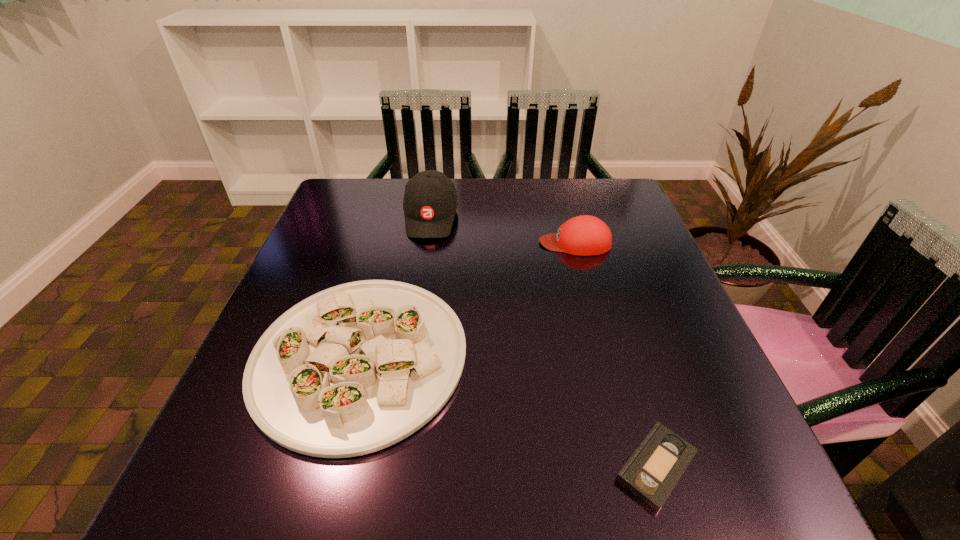
Identify the location of vacant region between the shortest object and the shorter baseball cap. (615, 355).

Where is `the closest object to the platter`? Image resolution: width=960 pixels, height=540 pixels. the closest object to the platter is located at coordinates (430, 202).

At what (x,y) coordinates should I click in order to perform the action: click on object that is the nearest to the taller baseball cap. Please return your answer as a coordinate pair (x, y). The width and height of the screenshot is (960, 540). Looking at the image, I should click on (353, 369).

This screenshot has width=960, height=540. I want to click on vacant region that satisfies the following two spatial constraints: 1. on the front-facing side of the shortest object; 2. on the left side of the right baseball cap, so click(636, 467).

Where is `free spot that satisfies the following two spatial constraints: 1. on the front-facing side of the shorter baseball cap; 2. on the left side of the shortest object`? The image size is (960, 540). free spot that satisfies the following two spatial constraints: 1. on the front-facing side of the shorter baseball cap; 2. on the left side of the shortest object is located at coordinates (636, 467).

This screenshot has height=540, width=960. I want to click on free space in the image that satisfies the following two spatial constraints: 1. on the front-facing side of the right baseball cap; 2. on the left side of the shortest object, so click(x=636, y=467).

I want to click on vacant space that satisfies the following two spatial constraints: 1. on the back side of the shortest object; 2. on the front-facing side of the shorter baseball cap, so click(x=588, y=242).

Image resolution: width=960 pixels, height=540 pixels. Find the location of `vacant space that satisfies the following two spatial constraints: 1. on the back side of the videotape; 2. on the front-facing side of the shorter baseball cap`. vacant space that satisfies the following two spatial constraints: 1. on the back side of the videotape; 2. on the front-facing side of the shorter baseball cap is located at coordinates (588, 242).

At what (x,y) coordinates should I click in order to perform the action: click on vacant space that satisfies the following two spatial constraints: 1. with a logo on the front of the videotape; 2. on the right side of the tallest object. Please return your answer as a coordinate pair (x, y). The height and width of the screenshot is (540, 960). Looking at the image, I should click on (393, 467).